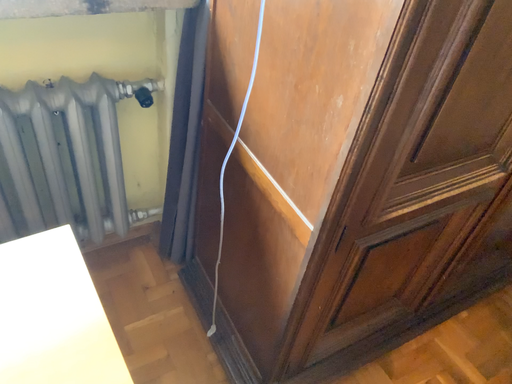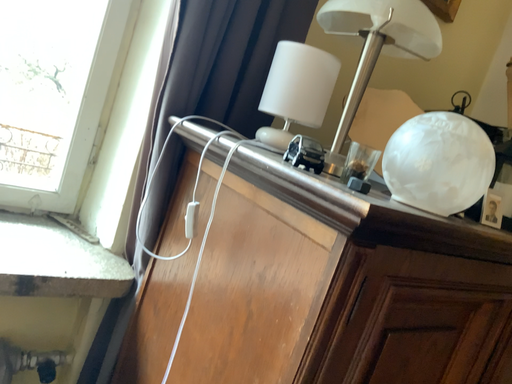
Question: Which way did the camera rotate in the video?

Choices:
 (A) rotated left
 (B) rotated right

Answer: (B)